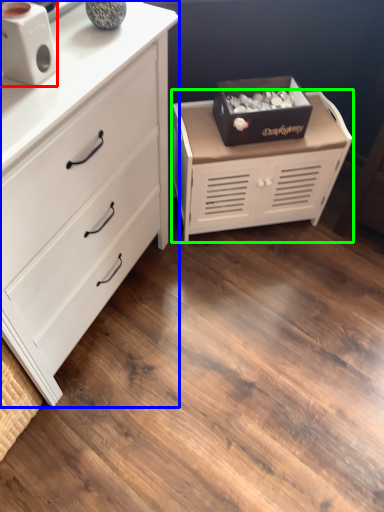
Question: Which object is positioned closest to speaker (highlighted by a red box)? Select from chest of drawers (highlighted by a blue box) and chest of drawers (highlighted by a green box).

Choices:
 (A) chest of drawers
 (B) chest of drawers

Answer: (A)